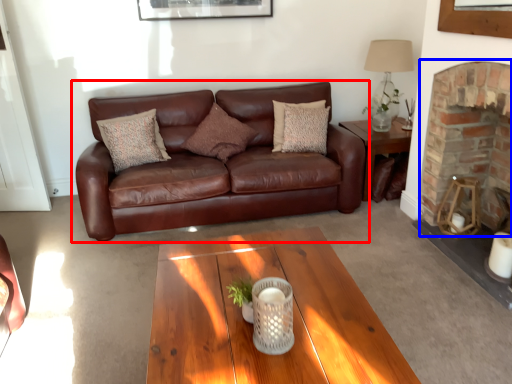
Question: Among these objects, which one is nearest to the camera, studio couch (highlighted by a red box) or fireplace (highlighted by a blue box)?

Choices:
 (A) studio couch
 (B) fireplace

Answer: (B)